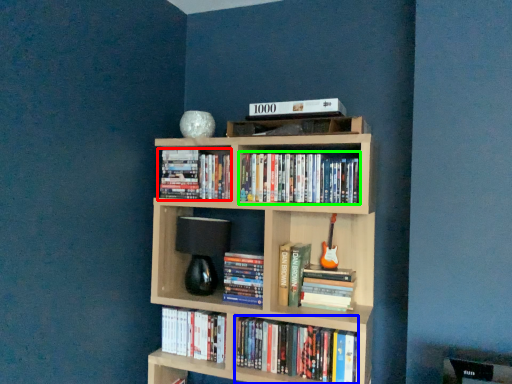
Question: Based on their relative distances, which object is farther from book (highlighted by a red box)? Choose from book (highlighted by a blue box) and book (highlighted by a green box).

Choices:
 (A) book
 (B) book

Answer: (A)